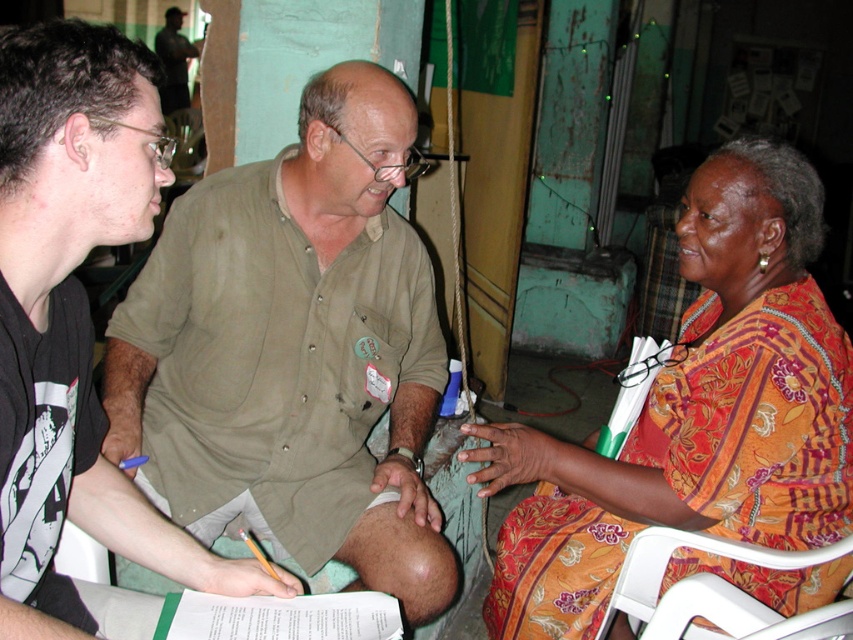
You are organizing a community event and need to decide which item to use for a backdrop. The floral print fabric at right and the green matte shirt at left are available. Based on their sizes, which would be more suitable for a backdrop?

The floral print fabric at right is larger in size than the green matte shirt at left, making it more suitable for a backdrop.

You are a photographer setting up for a group photo. You need to ensure that the green cotton shirt at center and the white plastic folding chair at lower right are both in frame. Based on their positions, which object should you adjust to be more to the right to include both in the photo?

The green cotton shirt at center is positioned on the left side of white plastic folding chair at lower right. To include both in the photo, you should adjust the white plastic folding chair at lower right to be more to the right so that the green cotton shirt at center remains on its left while creating space for the chair on the right side of the frame.

In the scene, there are two people and a point marked at coordinates [74,314]. Which object does this point correspond to?

The point at coordinates [74,314] corresponds to the green matte shirt at left.